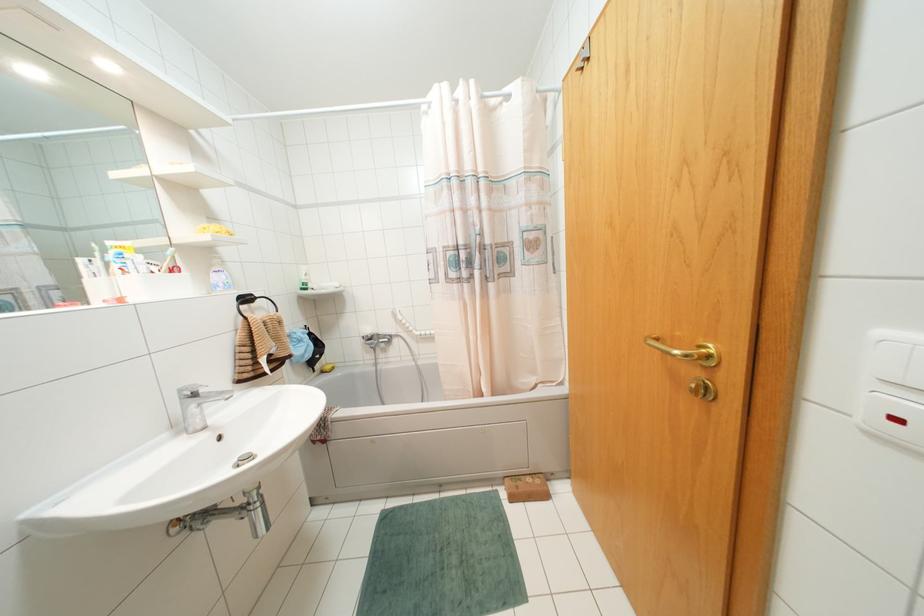
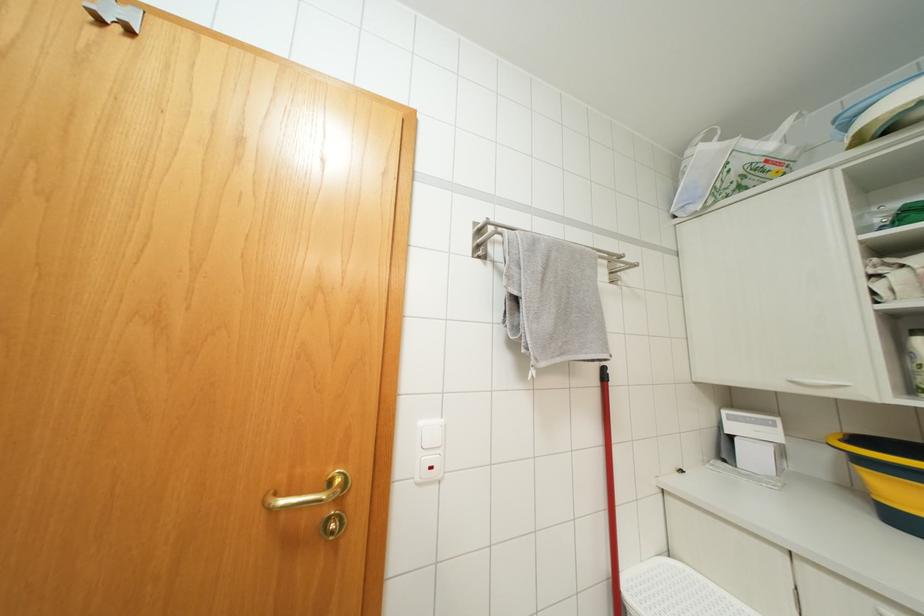
Question: The camera is either moving clockwise (left) or counter-clockwise (right) around the object. The first image is from the beginning of the video and the second image is from the end. Is the camera moving left or right when shooting the video?

Choices:
 (A) Left
 (B) Right

Answer: (A)